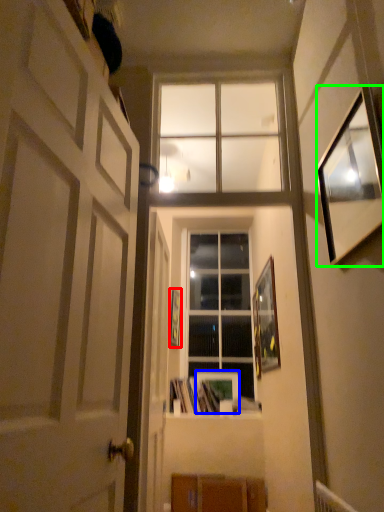
Question: Which object is the closest to the picture frame (highlighted by a red box)? Choose among these: picture frame (highlighted by a blue box) or picture frame (highlighted by a green box).

Choices:
 (A) picture frame
 (B) picture frame

Answer: (A)